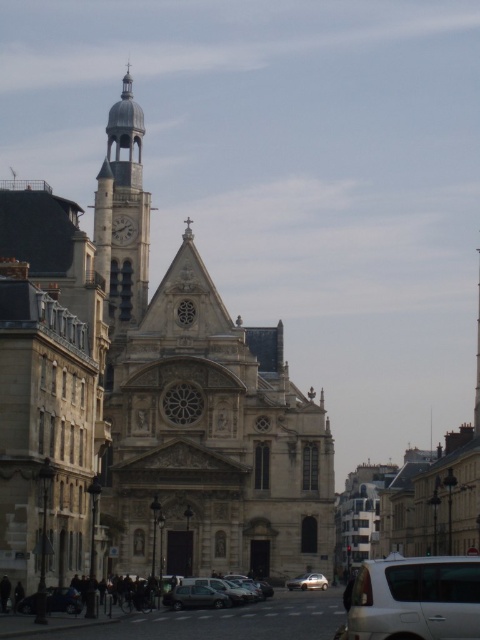
Measure the distance between white matte car at lower right and metallic silver car at lower left.

They are 21.63 meters apart.

Does white matte car at lower right have a greater height compared to metallic silver car at lower left?

Correct, white matte car at lower right is much taller as metallic silver car at lower left.

Which is behind, point (441, 589) or point (56, 611)?

The point (56, 611) is more distant.

Where is `white matte car at lower right`? The image size is (480, 640). white matte car at lower right is located at coordinates (414, 598).

How much distance is there between polished brass clock tower at upper left and dark gray metallic car at center?

166.13 feet

Describe the element at coordinates (122, 211) in the screenshot. This screenshot has height=640, width=480. I see `polished brass clock tower at upper left` at that location.

Find the location of a particular element. The width and height of the screenshot is (480, 640). polished brass clock tower at upper left is located at coordinates (122, 211).

I want to click on white matte car at lower right, so (414, 598).

Measure the distance from white matte car at lower right to dark gray metallic car at center.

white matte car at lower right is 29.35 meters away from dark gray metallic car at center.

The width and height of the screenshot is (480, 640). What do you see at coordinates (414, 598) in the screenshot?
I see `white matte car at lower right` at bounding box center [414, 598].

At what (x,y) coordinates should I click in order to perform the action: click on white matte car at lower right. Please return your answer as a coordinate pair (x, y). Looking at the image, I should click on (414, 598).